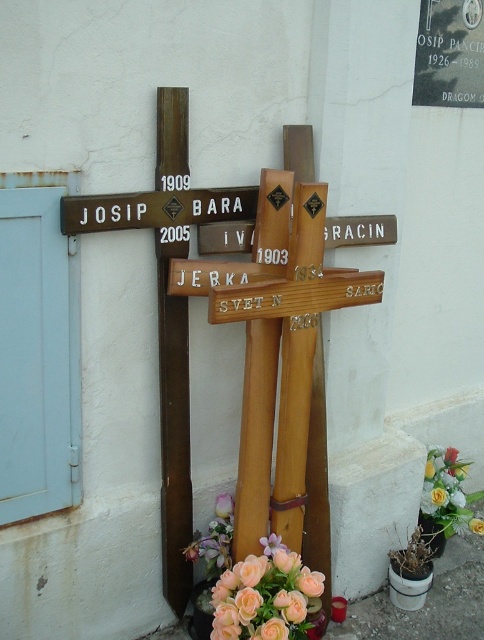
Question: Which point is farther from the camera taking this photo?

Choices:
 (A) (463, 472)
 (B) (267, 552)
 (C) (265, 538)
 (D) (13, 214)

Answer: (A)

Question: Can you confirm if pink matte flower at center is positioned below pink silk flower at lower center?

Choices:
 (A) yes
 (B) no

Answer: (A)

Question: Can you confirm if light blue painted wood at left is positioned to the right of soft peach petals at lower center?

Choices:
 (A) yes
 (B) no

Answer: (B)

Question: Is wooden cross at center smaller than pink matte flower at center?

Choices:
 (A) yes
 (B) no

Answer: (B)

Question: Among these points, which one is nearest to the camera?

Choices:
 (A) (34, 188)
 (B) (456, 492)
 (C) (391, 241)
 (D) (216, 198)

Answer: (A)

Question: Which object appears farthest from the camera in this image?

Choices:
 (A) light blue painted wood at left
 (B) pink matte flower at center

Answer: (B)